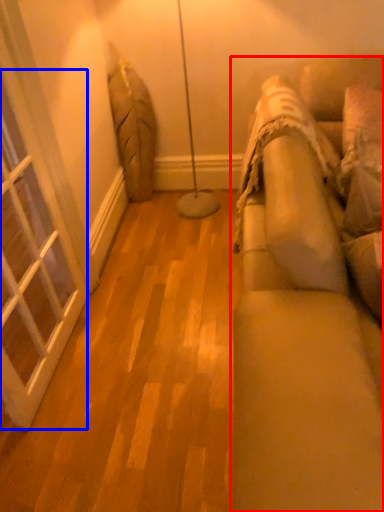
Question: Which of the following is the closest to the observer, studio couch (highlighted by a red box) or window (highlighted by a blue box)?

Choices:
 (A) studio couch
 (B) window

Answer: (A)